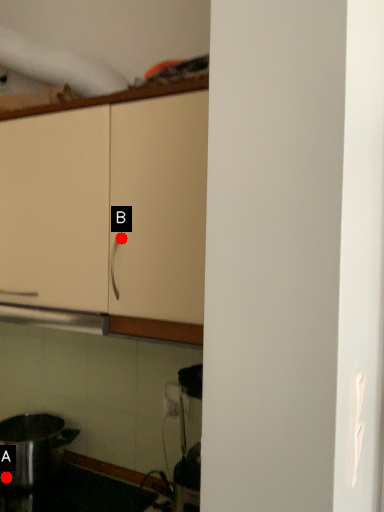
Question: Two points are circled on the image, labeled by A and B beside each circle. Among these points, which one is nearest to the camera?

Choices:
 (A) A is closer
 (B) B is closer

Answer: (B)